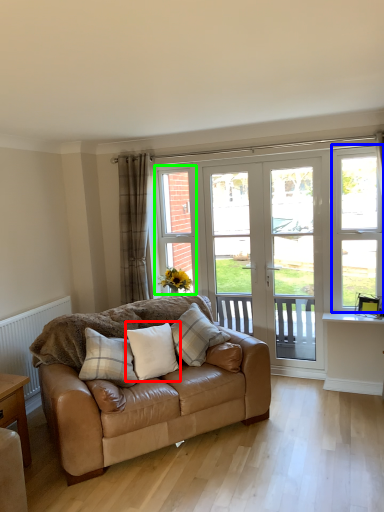
Question: Considering the real-world distances, which object is farthest from pillow (highlighted by a red box)? window frame (highlighted by a blue box) or window (highlighted by a green box)?

Choices:
 (A) window frame
 (B) window

Answer: (A)